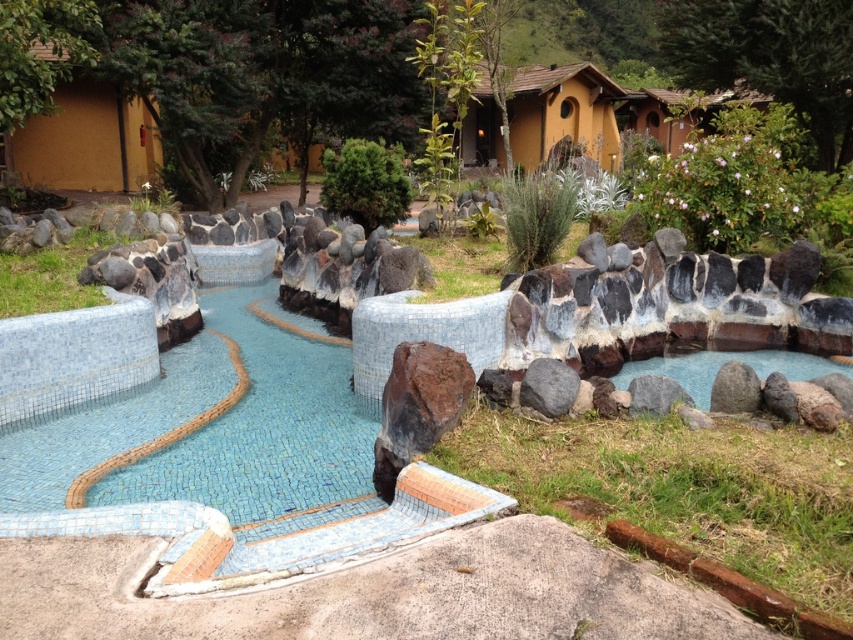
Can you confirm if brown rough rock at center is positioned to the left of smooth stone pond at right?

Correct, you'll find brown rough rock at center to the left of smooth stone pond at right.

Who is positioned more to the right, brown rough rock at center or smooth stone pond at right?

smooth stone pond at right

Between point (462, 362) and point (811, 374), which one is positioned in front?

Point (462, 362) is more forward.

Image resolution: width=853 pixels, height=640 pixels. Identify the location of brown rough rock at center. (421, 400).

Measure the distance between dark gray rock at center and camera.

3.98 meters

Does point (549, 403) come behind point (724, 381)?

No, it is not.

Find the location of a particular element. This screenshot has height=640, width=853. dark gray rock at center is located at coordinates click(548, 387).

Is point (554, 380) behind point (631, 404)?

Yes, it is.

Where is `dark gray rock at center`? The width and height of the screenshot is (853, 640). dark gray rock at center is located at coordinates (548, 387).

Image resolution: width=853 pixels, height=640 pixels. I want to click on dark gray rock at center, so click(548, 387).